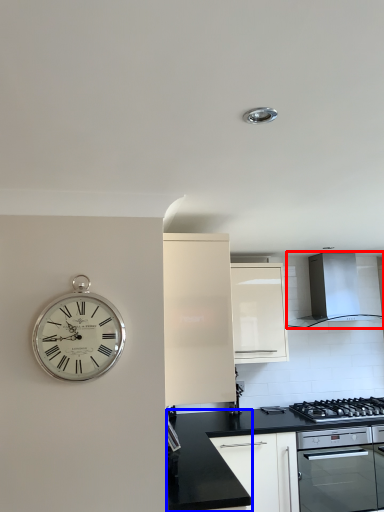
Question: Which of the following is the farthest to the observer, home appliance (highlighted by a red box) or counter top (highlighted by a blue box)?

Choices:
 (A) home appliance
 (B) counter top

Answer: (A)